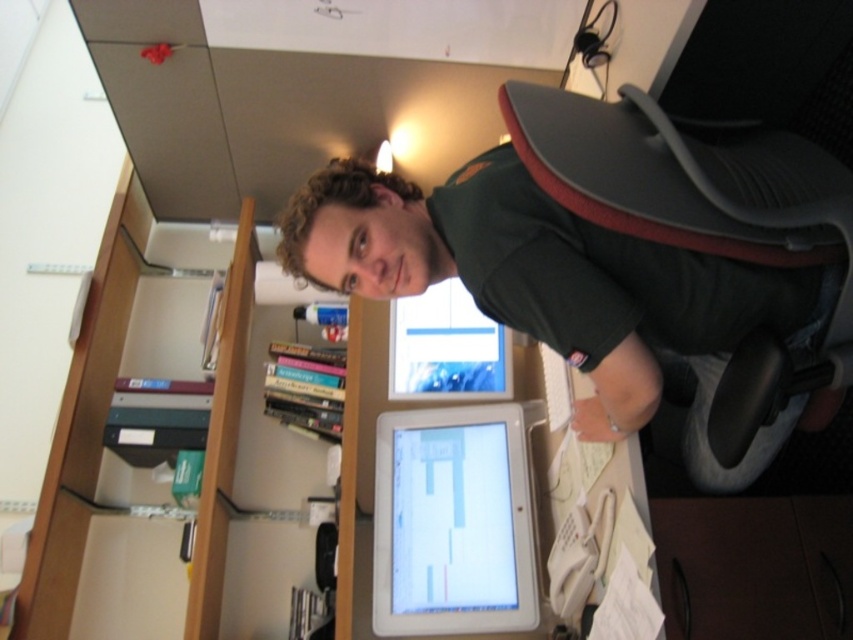
Question: Among these points, which one is farthest from the camera?

Choices:
 (A) (521, 444)
 (B) (492, 388)

Answer: (B)

Question: Which object is farther from the camera taking this photo?

Choices:
 (A) matte plastic monitor at center
 (B) dark green shirt at upper center
 (C) wooden at left
 (D) white glossy tablet at center

Answer: (A)

Question: In this image, where is dark green shirt at upper center located relative to matte plastic monitor at center?

Choices:
 (A) above
 (B) below

Answer: (A)

Question: Is the position of white glossy tablet at center more distant than that of wooden at left?

Choices:
 (A) yes
 (B) no

Answer: (A)

Question: Is dark green shirt at upper center smaller than wooden at left?

Choices:
 (A) no
 (B) yes

Answer: (A)

Question: Which point is farther to the camera?

Choices:
 (A) (80, 356)
 (B) (689, 323)
 (C) (438, 284)
 (D) (485, 547)

Answer: (A)